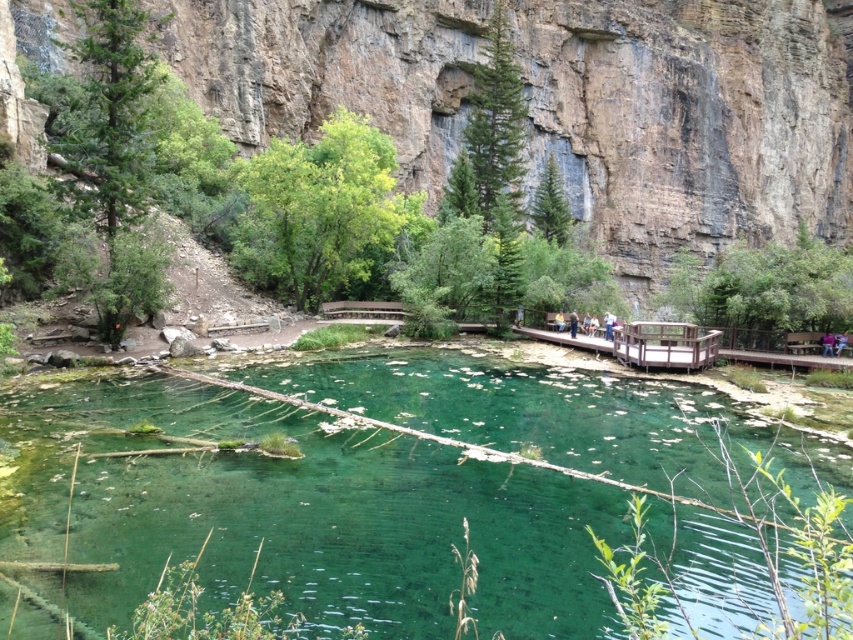
In the scene shown: Can you confirm if green translucent water at center is positioned to the right of brown rock canyon at center?

No, green translucent water at center is not to the right of brown rock canyon at center.

In the scene shown: Can you confirm if green translucent water at center is taller than brown rock canyon at center?

In fact, green translucent water at center may be shorter than brown rock canyon at center.

Is point (311, 416) behind point (444, 150)?

No.

I want to click on green translucent water at center, so click(x=302, y=513).